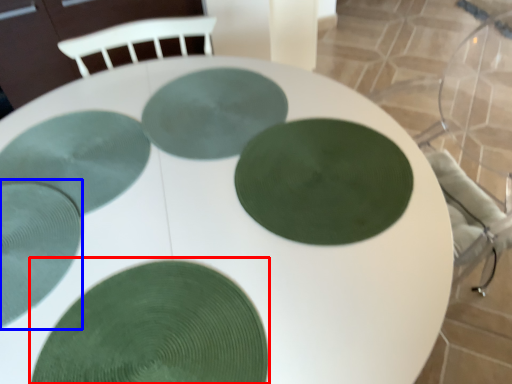
Question: Which object is closer to the camera taking this photo, glass plate (highlighted by a red box) or glass plate (highlighted by a blue box)?

Choices:
 (A) glass plate
 (B) glass plate

Answer: (A)